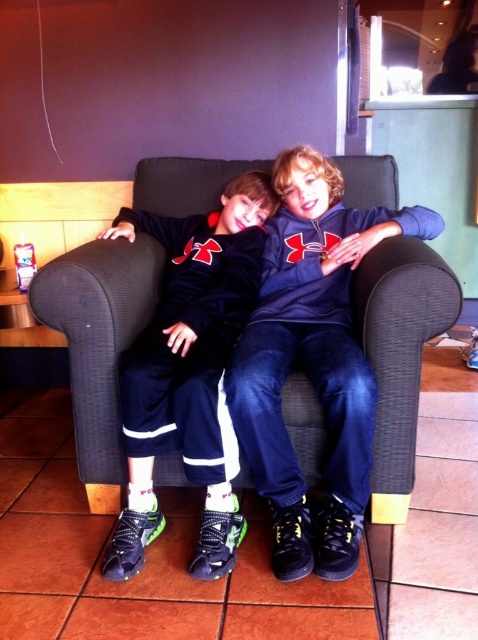
Can you confirm if dark blue fabric couch at center is shorter than matte black pants at center?

No.

Is point (452, 284) in front of point (228, 314)?

Yes.

You are a GUI agent. You are given a task and a screenshot of the screen. Output one action in this format:
    pyautogui.click(x=<x>, y=<y>)
    Task: Click on the dark blue fabric couch at center
    The height and width of the screenshot is (640, 478).
    Given the screenshot: What is the action you would take?
    pyautogui.click(x=98, y=340)

Does point (144, 172) lie behind point (288, 563)?

Yes, point (144, 172) is behind point (288, 563).

Is dark blue fabric couch at center in front of matte blue hoodie at center?

No, dark blue fabric couch at center is further to the viewer.

The height and width of the screenshot is (640, 478). Identify the location of dark blue fabric couch at center. (98, 340).

Does matte blue hoodie at center appear under matte black pants at center?

Incorrect, matte blue hoodie at center is not positioned below matte black pants at center.

Between matte blue hoodie at center and matte black pants at center, which one has less height?

matte black pants at center

You are a GUI agent. You are given a task and a screenshot of the screen. Output one action in this format:
    pyautogui.click(x=<x>, y=<y>)
    Task: Click on the matte blue hoodie at center
    
    Given the screenshot: What is the action you would take?
    pyautogui.click(x=313, y=362)

Where is `matte blue hoodie at center`? The image size is (478, 640). matte blue hoodie at center is located at coordinates (313, 362).